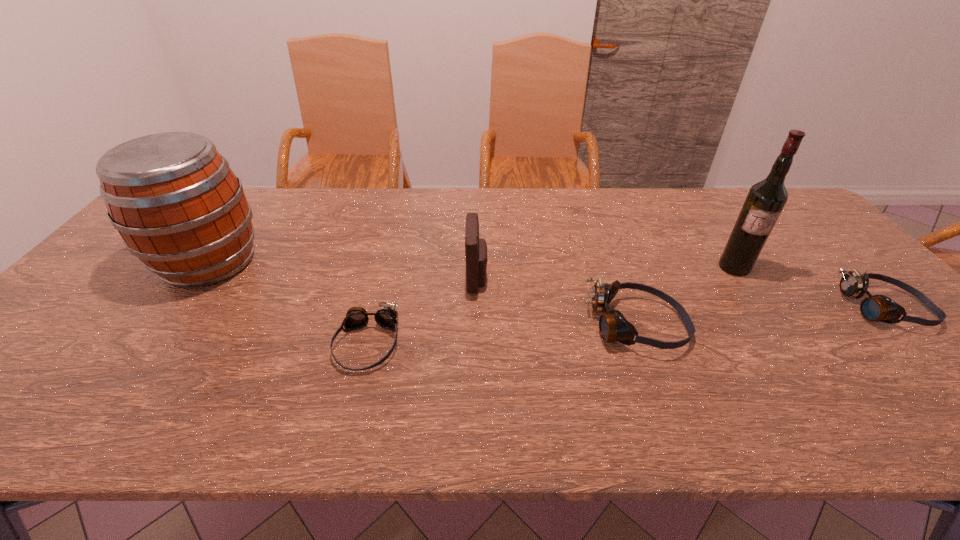
Identify the location of the leftmost goggles. This screenshot has width=960, height=540. (386, 316).

You are a GUI agent. You are given a task and a screenshot of the screen. Output one action in this format:
    pyautogui.click(x=<x>, y=<y>)
    Task: Click on the second object from left to right
    This screenshot has height=540, width=960.
    Given the screenshot: What is the action you would take?
    pyautogui.click(x=386, y=316)

The width and height of the screenshot is (960, 540). In order to click on the third object from right to left in this screenshot , I will do `click(613, 327)`.

The height and width of the screenshot is (540, 960). What are the coordinates of `the second shortest object` in the screenshot? It's located at (875, 308).

At what (x,y) coordinates should I click in order to perform the action: click on the rightmost object. Please return your answer as a coordinate pair (x, y). Looking at the image, I should click on (875, 308).

Find the location of a particular element. the third object from left to right is located at coordinates (475, 249).

Locate an element on the screen. The height and width of the screenshot is (540, 960). the fourth shortest object is located at coordinates (475, 249).

In order to click on the second tallest object in this screenshot , I will do `click(178, 206)`.

Locate an element on the screen. The height and width of the screenshot is (540, 960). the leftmost object is located at coordinates (178, 206).

Locate an element on the screen. The width and height of the screenshot is (960, 540). wine bottle is located at coordinates (766, 199).